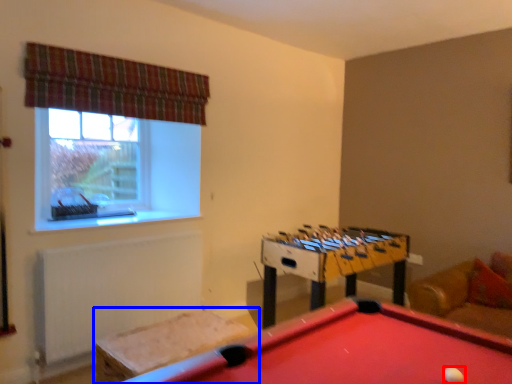
Question: Which object appears farthest to the camera in this image, ball (highlighted by a red box) or furniture (highlighted by a blue box)?

Choices:
 (A) ball
 (B) furniture

Answer: (B)